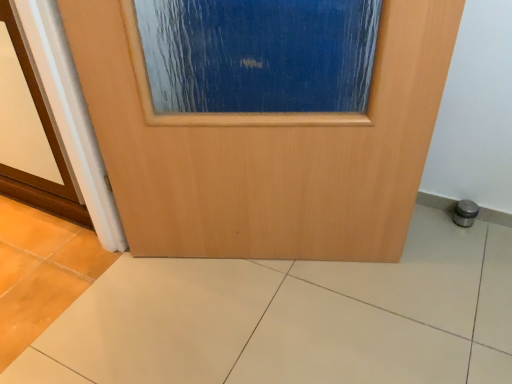
Question: Is beige ceramic tile at center surrounded by blue textured glass at center?

Choices:
 (A) no
 (B) yes

Answer: (A)

Question: Could you tell me if blue textured glass at center is turned towards beige ceramic tile at center?

Choices:
 (A) no
 (B) yes

Answer: (A)

Question: Is blue textured glass at center turned away from beige ceramic tile at center?

Choices:
 (A) yes
 (B) no

Answer: (B)

Question: Does blue textured glass at center have a larger size compared to beige ceramic tile at center?

Choices:
 (A) yes
 (B) no

Answer: (A)

Question: Is blue textured glass at center directly adjacent to beige ceramic tile at center?

Choices:
 (A) yes
 (B) no

Answer: (B)

Question: Considering the positions of wooden door at center and beige ceramic tile at center in the image, is wooden door at center taller or shorter than beige ceramic tile at center?

Choices:
 (A) short
 (B) tall

Answer: (B)

Question: From a real-world perspective, relative to beige ceramic tile at center, is wooden door at center vertically above or below?

Choices:
 (A) above
 (B) below

Answer: (A)

Question: Based on their sizes in the image, would you say wooden door at center is bigger or smaller than beige ceramic tile at center?

Choices:
 (A) small
 (B) big

Answer: (B)

Question: In terms of width, does wooden door at center look wider or thinner when compared to beige ceramic tile at center?

Choices:
 (A) thin
 (B) wide

Answer: (A)

Question: Considering the positions of point (315, 360) and point (138, 34), is point (315, 360) closer or farther from the camera than point (138, 34)?

Choices:
 (A) farther
 (B) closer

Answer: (A)

Question: Considering their positions, is beige ceramic tile at center located in front of or behind blue textured glass at center?

Choices:
 (A) behind
 (B) front

Answer: (B)

Question: From the image's perspective, relative to blue textured glass at center, is beige ceramic tile at center above or below?

Choices:
 (A) below
 (B) above

Answer: (A)

Question: Visually, is beige ceramic tile at center positioned to the left or to the right of blue textured glass at center?

Choices:
 (A) left
 (B) right

Answer: (B)

Question: Is wooden door at center taller or shorter than blue textured glass at center?

Choices:
 (A) short
 (B) tall

Answer: (B)

Question: Is wooden door at center in front of or behind blue textured glass at center in the image?

Choices:
 (A) front
 (B) behind

Answer: (A)